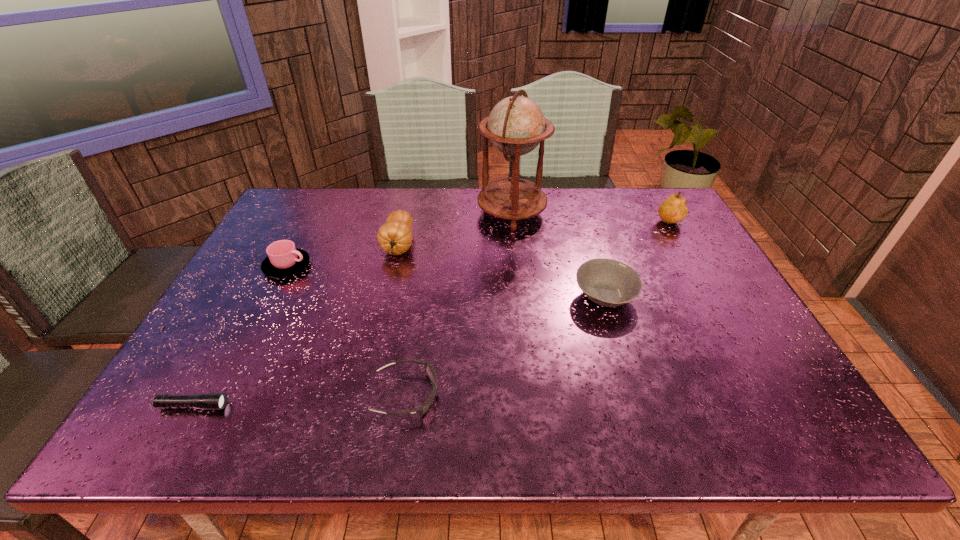
Locate an element on the screen. vacant space at the far left corner of the desktop is located at coordinates (327, 188).

The image size is (960, 540). Identify the location of vacant space at the near right corner of the desktop. (801, 433).

Image resolution: width=960 pixels, height=540 pixels. Find the location of `vacant area that lies between the flashlight and the third object from right to left`. vacant area that lies between the flashlight and the third object from right to left is located at coordinates (352, 309).

Locate an element on the screen. This screenshot has width=960, height=540. free space that is in between the third object from right to left and the gourd is located at coordinates (455, 228).

Find the location of a particular element. This screenshot has width=960, height=540. vacant area that lies between the goggles and the cup is located at coordinates (347, 330).

Identify the location of vacant space in between the flashlight and the sixth tallest object. The image size is (960, 540). (300, 400).

Where is `empty space that is in between the flashlight and the second object from right to left`? This screenshot has width=960, height=540. empty space that is in between the flashlight and the second object from right to left is located at coordinates (399, 352).

Identify the location of blank region between the globe and the bowl. The height and width of the screenshot is (540, 960). (559, 254).

I want to click on free point between the cup and the shortest object, so tap(240, 336).

This screenshot has height=540, width=960. In order to click on free point between the cup and the rightmost object in this screenshot , I will do `click(479, 246)`.